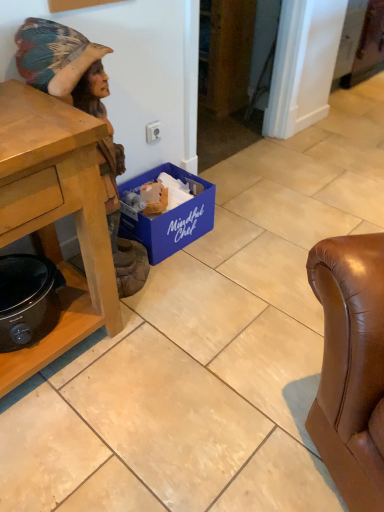
Where is `free point to the right of blue cardboard box at lower center`? Image resolution: width=384 pixels, height=512 pixels. free point to the right of blue cardboard box at lower center is located at coordinates (242, 233).